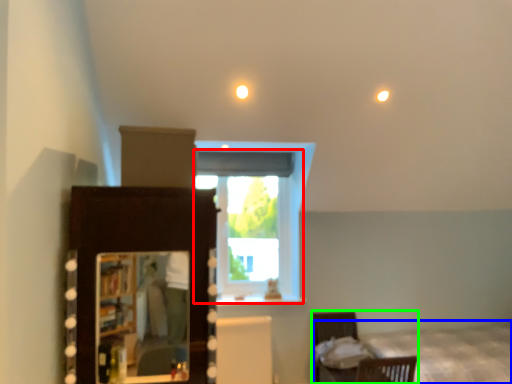
Question: Which object is positioned closest to window (highlighted by a red box)? Select from bed (highlighted by a blue box) and furniture (highlighted by a green box).

Choices:
 (A) bed
 (B) furniture

Answer: (A)